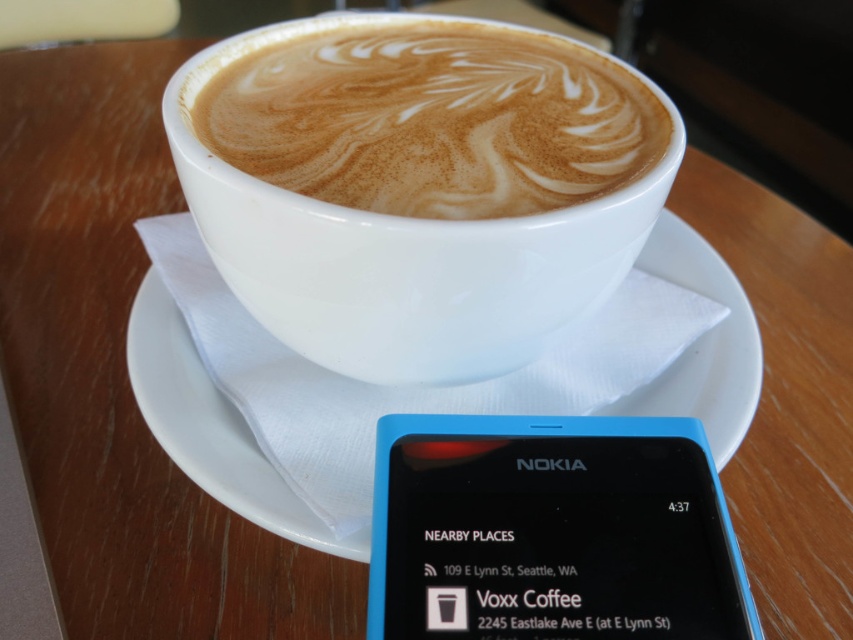
Who is higher up, blue plastic nokia phone at lower center or white matte cup at center?

white matte cup at center is higher up.

Describe the element at coordinates (550, 531) in the screenshot. I see `blue plastic nokia phone at lower center` at that location.

Find the location of a particular element. The height and width of the screenshot is (640, 853). blue plastic nokia phone at lower center is located at coordinates (550, 531).

Who is lower down, white matte cup at center or white ceramic saucer at upper center?

white ceramic saucer at upper center is below.

The image size is (853, 640). What are the coordinates of `white matte cup at center` in the screenshot? It's located at (434, 120).

Which is below, blue plastic nokia phone at lower center or white ceramic saucer at upper center?

blue plastic nokia phone at lower center is lower down.

Is blue plastic nokia phone at lower center behind white ceramic saucer at upper center?

No, it is not.

Is point (645, 468) less distant than point (231, 435)?

Yes, point (645, 468) is in front of point (231, 435).

Find the location of a particular element. blue plastic nokia phone at lower center is located at coordinates (550, 531).